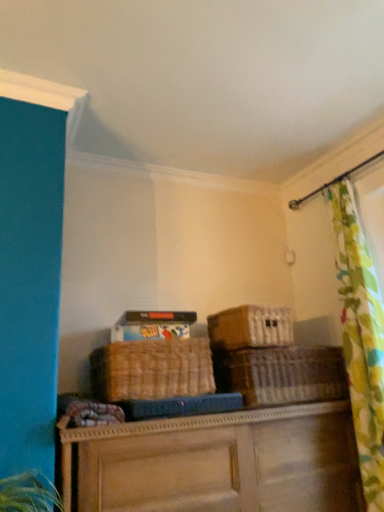
The height and width of the screenshot is (512, 384). Describe the element at coordinates (285, 375) in the screenshot. I see `woven brown basket at center, which appears as the 1th basket when viewed from the right` at that location.

Where is `brown woven basket at center, the 2th basket when ordered from left to right`? brown woven basket at center, the 2th basket when ordered from left to right is located at coordinates (250, 327).

The width and height of the screenshot is (384, 512). What do you see at coordinates (153, 325) in the screenshot?
I see `matte cardboard storage box at upper center` at bounding box center [153, 325].

At what (x,y) coordinates should I click in order to perform the action: click on floral fabric curtain at right. Please return your answer as a coordinate pair (x, y). The height and width of the screenshot is (512, 384). Looking at the image, I should click on (361, 338).

How different are the orientations of woven brown basket at center, the third basket from the right, and matte cardboard storage box at upper center in degrees?

The facing directions of woven brown basket at center, the third basket from the right, and matte cardboard storage box at upper center are 5.47 degrees apart.

From the image's perspective, between woven brown basket at center, the third basket from the right, and matte cardboard storage box at upper center, who is located below?

woven brown basket at center, the third basket from the right.

In the image, there is a woven brown basket at center, the third basket from the right. Identify the location of storage box above it (from the image's perspective). (153, 325).

Could you measure the distance between woven brown basket at center, which appears as the 1th basket when viewed from the left, and matte cardboard storage box at upper center?

A distance of 6.43 inches exists between woven brown basket at center, which appears as the 1th basket when viewed from the left, and matte cardboard storage box at upper center.

Can woven brown basket at center, the 3th basket when ordered from left to right, be found inside brown woven basket at center, the 2th basket when ordered from left to right?

That's incorrect, woven brown basket at center, the 3th basket when ordered from left to right, is not inside brown woven basket at center, the 2th basket when ordered from left to right.

Where is `the 2nd basket positioned below the brown woven basket at center, arranged as the 2th basket when viewed from the right (from the image's perspective)`? This screenshot has height=512, width=384. the 2nd basket positioned below the brown woven basket at center, arranged as the 2th basket when viewed from the right (from the image's perspective) is located at coordinates (285, 375).

In the image, is brown woven basket at center, the 2th basket when ordered from left to right, positioned in front of or behind woven brown basket at center, which appears as the 1th basket when viewed from the right?

brown woven basket at center, the 2th basket when ordered from left to right, is behind woven brown basket at center, which appears as the 1th basket when viewed from the right.

In terms of height, does woven brown basket at center, the third basket from the right, look taller or shorter compared to woven wicker basket at center?

In the image, woven brown basket at center, the third basket from the right, appears to be shorter than woven wicker basket at center.

Based on the photo, from the image's perspective, would you say woven brown basket at center, the third basket from the right, is shown under woven wicker basket at center?

Actually, woven brown basket at center, the third basket from the right, appears above woven wicker basket at center in the image.

Does woven brown basket at center, the third basket from the right, lie in front of woven wicker basket at center?

No, it is behind woven wicker basket at center.

Is woven wicker basket at center at the back of woven brown basket at center, which appears as the 1th basket when viewed from the left?

No, woven wicker basket at center is not at the back of woven brown basket at center, which appears as the 1th basket when viewed from the left.

Looking at this image, how many degrees apart are the facing directions of floral fabric curtain at right and brown woven basket at center, the 2th basket when ordered from left to right?

91.6 degrees.

Are floral fabric curtain at right and brown woven basket at center, arranged as the 2th basket when viewed from the right, making contact?

No, floral fabric curtain at right is not making contact with brown woven basket at center, arranged as the 2th basket when viewed from the right.

Is floral fabric curtain at right facing towards brown woven basket at center, the 2th basket when ordered from left to right?

No, floral fabric curtain at right is not turned towards brown woven basket at center, the 2th basket when ordered from left to right.

How many degrees apart are the facing directions of matte cardboard storage box at upper center and floral fabric curtain at right?

84.6 degrees.

Is matte cardboard storage box at upper center facing towards floral fabric curtain at right?

No.

Which of these two, matte cardboard storage box at upper center or floral fabric curtain at right, is bigger?

With larger size is floral fabric curtain at right.

Which object is further away from the camera, matte cardboard storage box at upper center or floral fabric curtain at right?

matte cardboard storage box at upper center is further away from the camera.

Considering the relative positions of brown woven basket at center, the 2th basket when ordered from left to right, and woven wicker basket at center in the image provided, is brown woven basket at center, the 2th basket when ordered from left to right, to the right of woven wicker basket at center from the viewer's perspective?

Correct, you'll find brown woven basket at center, the 2th basket when ordered from left to right, to the right of woven wicker basket at center.

How far apart are brown woven basket at center, arranged as the 2th basket when viewed from the right, and woven wicker basket at center?

brown woven basket at center, arranged as the 2th basket when viewed from the right, is 23.58 inches away from woven wicker basket at center.

Considering the relative sizes of brown woven basket at center, arranged as the 2th basket when viewed from the right, and woven wicker basket at center in the image provided, is brown woven basket at center, arranged as the 2th basket when viewed from the right, wider than woven wicker basket at center?

No, brown woven basket at center, arranged as the 2th basket when viewed from the right, is not wider than woven wicker basket at center.

Is brown woven basket at center, arranged as the 2th basket when viewed from the right, directly adjacent to woven wicker basket at center?

brown woven basket at center, arranged as the 2th basket when viewed from the right, is not next to woven wicker basket at center, and they're not touching.

Is matte cardboard storage box at upper center facing away from woven brown basket at center, which appears as the 1th basket when viewed from the left?

No.

Is matte cardboard storage box at upper center positioned far away from woven brown basket at center, which appears as the 1th basket when viewed from the left?

matte cardboard storage box at upper center is near woven brown basket at center, which appears as the 1th basket when viewed from the left, not far away.

Between matte cardboard storage box at upper center and woven brown basket at center, the third basket from the right, which one has larger size?

With larger size is woven brown basket at center, the third basket from the right.

Is matte cardboard storage box at upper center taller or shorter than woven brown basket at center, the third basket from the right?

Considering their sizes, matte cardboard storage box at upper center has less height than woven brown basket at center, the third basket from the right.

Locate an element on the screen. This screenshot has width=384, height=512. storage box that appears on the right of woven brown basket at center, the third basket from the right is located at coordinates (153, 325).

Identify the location of basket behind the woven brown basket at center, which appears as the 1th basket when viewed from the right. Image resolution: width=384 pixels, height=512 pixels. (250, 327).

Considering their positions, is woven brown basket at center, which appears as the 1th basket when viewed from the right, positioned further to matte cardboard storage box at upper center than woven brown basket at center, the third basket from the right?

The object further to matte cardboard storage box at upper center is woven brown basket at center, which appears as the 1th basket when viewed from the right.

From the image, which object appears to be nearer to woven brown basket at center, the third basket from the right, woven wicker basket at center or woven brown basket at center, the 3th basket when ordered from left to right?

Based on the image, woven wicker basket at center appears to be nearer to woven brown basket at center, the third basket from the right.

From the picture: Looking at the image, which one is located closer to floral fabric curtain at right, matte cardboard storage box at upper center or brown woven basket at center, the 2th basket when ordered from left to right?

Based on the image, brown woven basket at center, the 2th basket when ordered from left to right, appears to be nearer to floral fabric curtain at right.

Based on their spatial positions, is brown woven basket at center, the 2th basket when ordered from left to right, or floral fabric curtain at right closer to matte cardboard storage box at upper center?

Among the two, brown woven basket at center, the 2th basket when ordered from left to right, is located nearer to matte cardboard storage box at upper center.

Looking at the image, which one is located further to brown woven basket at center, arranged as the 2th basket when viewed from the right, woven brown basket at center, which appears as the 1th basket when viewed from the left, or woven wicker basket at center?

woven wicker basket at center is positioned further to the anchor brown woven basket at center, arranged as the 2th basket when viewed from the right.

Which object lies nearer to the anchor point woven wicker basket at center, floral fabric curtain at right or woven brown basket at center, the 3th basket when ordered from left to right?

woven brown basket at center, the 3th basket when ordered from left to right.

When comparing their distances from floral fabric curtain at right, does matte cardboard storage box at upper center or woven brown basket at center, which appears as the 1th basket when viewed from the right, seem closer?

woven brown basket at center, which appears as the 1th basket when viewed from the right.

Considering their positions, is brown woven basket at center, arranged as the 2th basket when viewed from the right, positioned further to woven brown basket at center, the 3th basket when ordered from left to right, than floral fabric curtain at right?

floral fabric curtain at right is further to woven brown basket at center, the 3th basket when ordered from left to right.

Find the location of a particular element. storage box situated between woven brown basket at center, which appears as the 1th basket when viewed from the left, and floral fabric curtain at right from left to right is located at coordinates (153, 325).

Where is `furniture located between matte cardboard storage box at upper center and floral fabric curtain at right in the left-right direction`? The height and width of the screenshot is (512, 384). furniture located between matte cardboard storage box at upper center and floral fabric curtain at right in the left-right direction is located at coordinates (218, 463).

Locate an element on the screen. The width and height of the screenshot is (384, 512). curtain between brown woven basket at center, the 2th basket when ordered from left to right, and woven wicker basket at center, in the vertical direction is located at coordinates (361, 338).

Locate an element on the screen. basket located between woven brown basket at center, which appears as the 1th basket when viewed from the left, and woven brown basket at center, which appears as the 1th basket when viewed from the right, in the left-right direction is located at coordinates (250, 327).